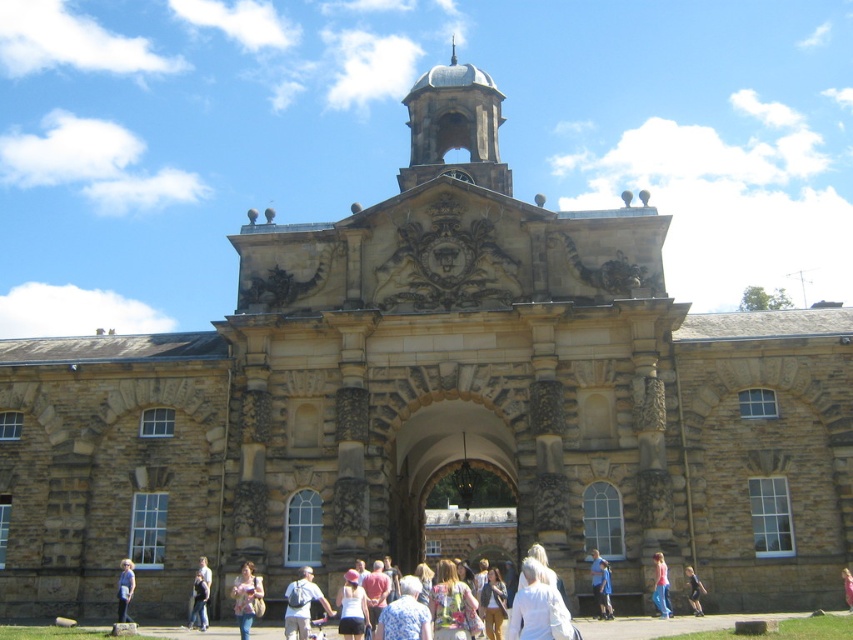
You are standing in front of the grand stone building and see a person wearing light blue denim jeans at lower center and a light blue shirt at center. Which piece of clothing is closer to the ground?

The light blue denim jeans at lower center is located below the light blue shirt at center, so the light blue denim jeans at lower center is closer to the ground.

You are an architect designing a new addition to the building. You need to place a new sculpture that must be wider than the pink fabric at center. Can the sculpture fit in the space where the smooth stone bell tower at upper center is currently located?

The smooth stone bell tower at upper center might be wider than the pink fabric at center, so the sculpture could potentially fit there if the tower is indeed wider, but the exact dimensions are uncertain. Further measurements would be needed to confirm.

You are standing in front of the grand stone building and see a point marked at coordinates [454,125]. Based on the scene description, can you identify what architectural feature this point is located on?

The point at coordinates [454,125] is located on the smooth stone bell tower at upper center.